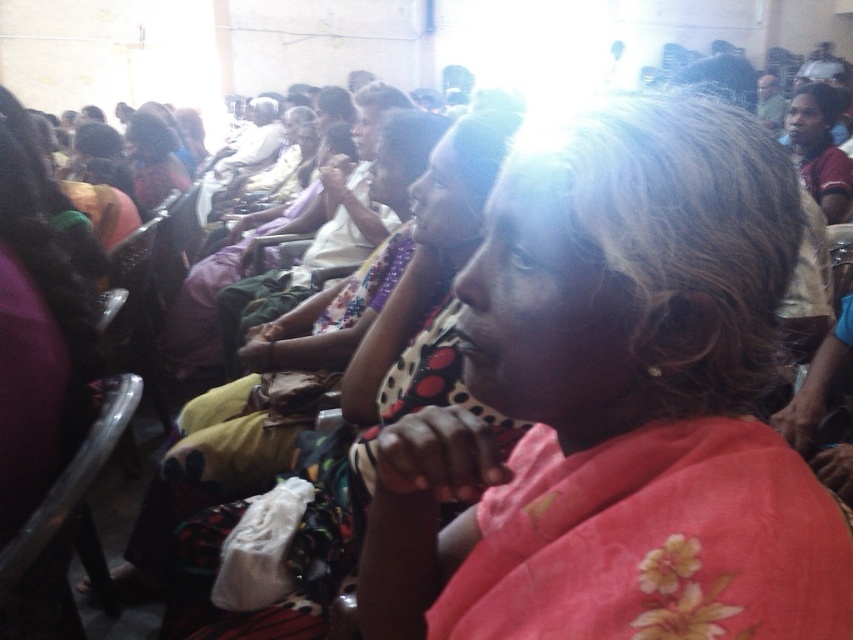
Does floral pink scarf at center have a larger size compared to polka dot fabric dress at center?

No.

Who is more forward, (538, 177) or (412, 275)?

Point (538, 177) is in front.

Which is in front, point (630, 225) or point (312, 506)?

Point (630, 225) is in front.

What are the coordinates of `floral pink scarf at center` in the screenshot? It's located at (614, 403).